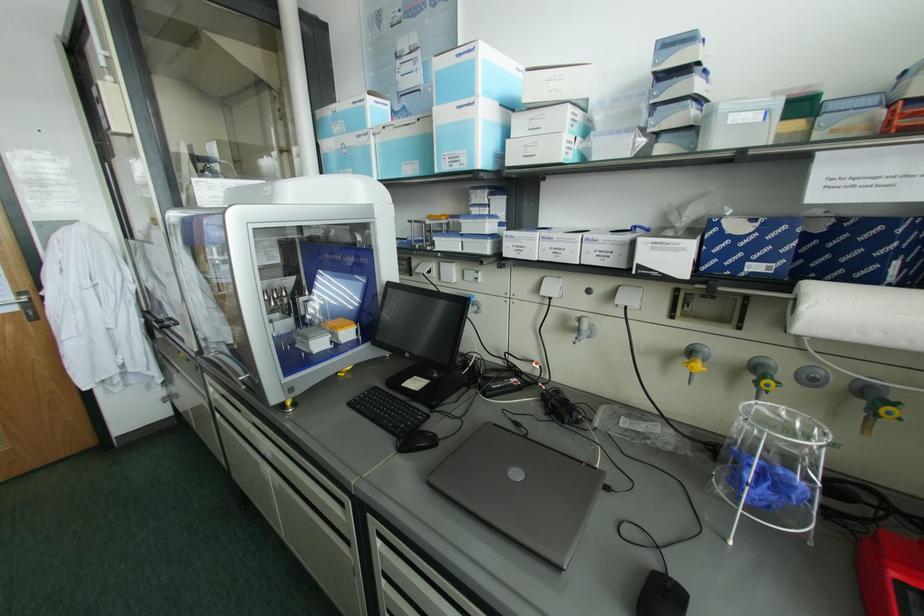
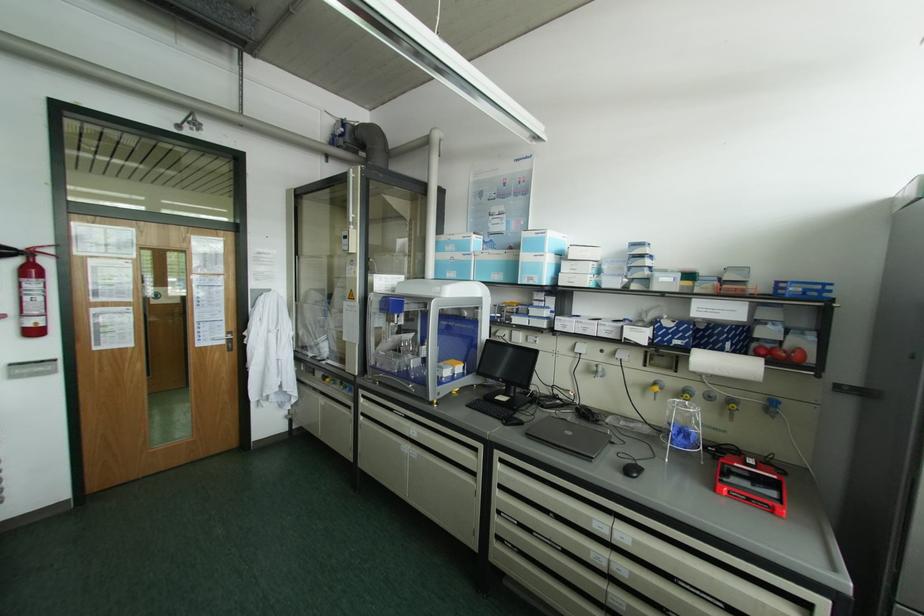
Locate, in the second image, the point that corresponds to point (350, 140) in the first image.

(457, 256)